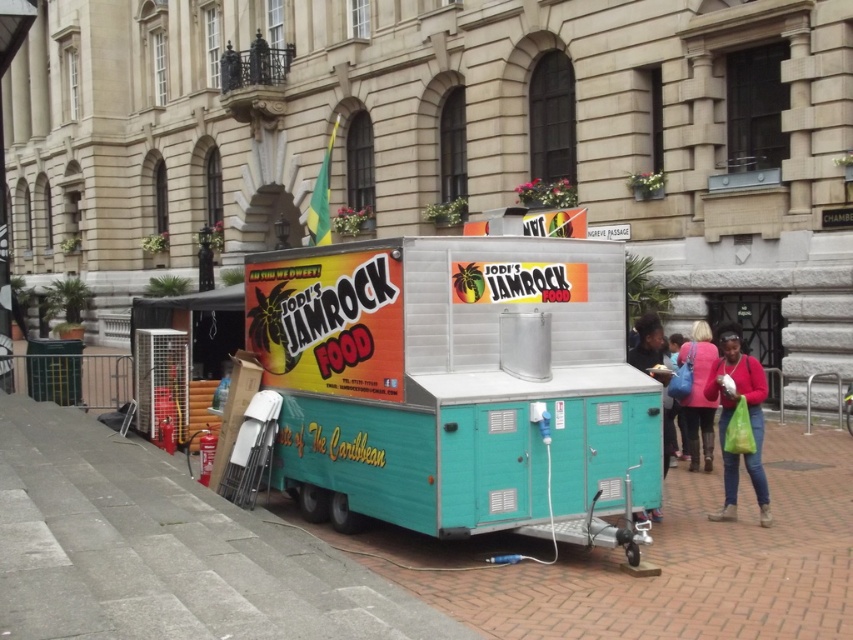
Can you confirm if teal matte food truck at center is positioned to the left of matte pink sweater at lower right?

Correct, you'll find teal matte food truck at center to the left of matte pink sweater at lower right.

Does point (323, 248) come closer to viewer compared to point (753, 422)?

That is True.

What do you see at coordinates (456, 385) in the screenshot? I see `teal matte food truck at center` at bounding box center [456, 385].

This screenshot has height=640, width=853. Identify the location of teal matte food truck at center. (456, 385).

Between matte pink jacket at center and teal plastic food cart at right, which one is positioned lower?

matte pink jacket at center is below.

Is point (691, 465) positioned after point (648, 324)?

That is True.

Locate an element on the screen. The image size is (853, 640). matte pink jacket at center is located at coordinates (698, 394).

Can you confirm if teal matte food truck at center is positioned to the right of matte pink jacket at center?

Incorrect, teal matte food truck at center is not on the right side of matte pink jacket at center.

Based on the photo, which of these two, teal matte food truck at center or matte pink jacket at center, stands shorter?

With less height is matte pink jacket at center.

The width and height of the screenshot is (853, 640). In order to click on teal matte food truck at center in this screenshot , I will do `click(456, 385)`.

Find the location of a particular element. teal matte food truck at center is located at coordinates (456, 385).